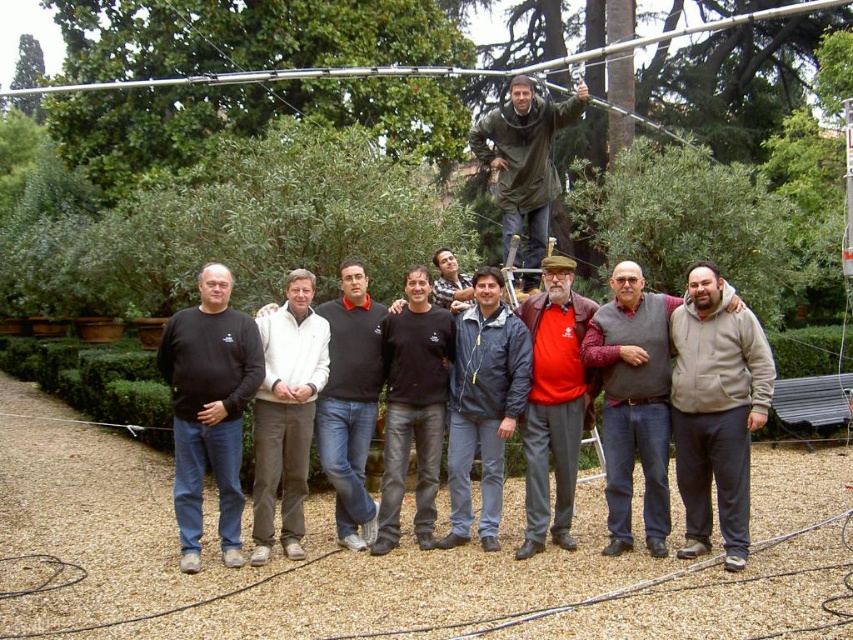
Which of these two, black cotton sweatshirt at center or black cotton shirt at center, stands shorter?

With less height is black cotton sweatshirt at center.

Is point (415, 301) farther from viewer compared to point (352, 506)?

Yes.

Does point (584, 321) lie behind point (344, 269)?

That is False.

The width and height of the screenshot is (853, 640). What are the coordinates of `black cotton sweatshirt at center` in the screenshot? It's located at 567,326.

Who is more forward, (575,360) or (753,403)?

Positioned in front is point (753,403).

Is black cotton sweatshirt at center to the left of gray fleece jacket at center from the viewer's perspective?

Correct, you'll find black cotton sweatshirt at center to the left of gray fleece jacket at center.

Where is `black cotton sweatshirt at center`? The width and height of the screenshot is (853, 640). black cotton sweatshirt at center is located at coordinates (567, 326).

Is black matte shirt at left behind dark blue jacket at center?

No, black matte shirt at left is in front of dark blue jacket at center.

How far apart are black matte shirt at left and dark blue jacket at center?

black matte shirt at left and dark blue jacket at center are 2.45 meters apart.

This screenshot has width=853, height=640. Identify the location of black matte shirt at left. pos(209,408).

Image resolution: width=853 pixels, height=640 pixels. What are the coordinates of `black matte shirt at left` in the screenshot? It's located at (209, 408).